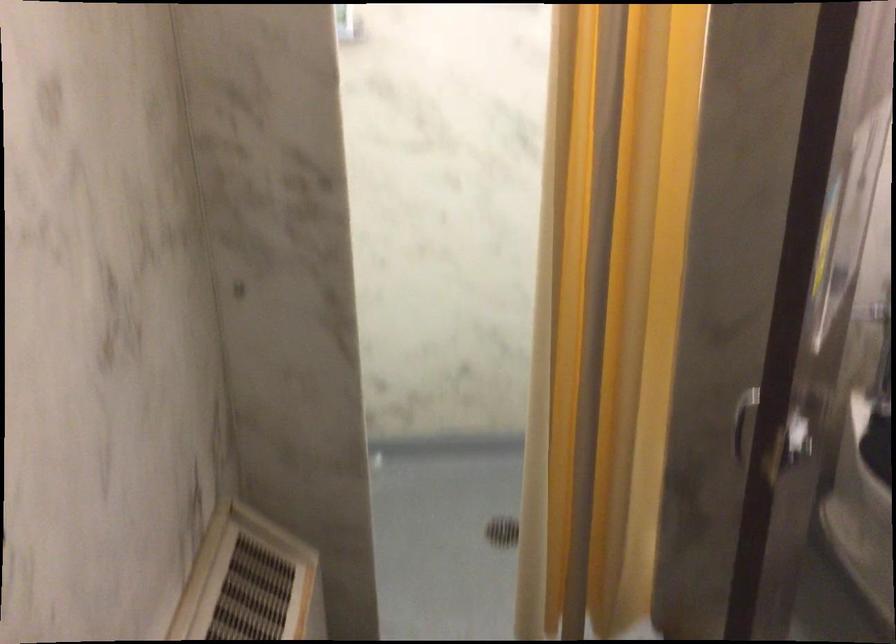
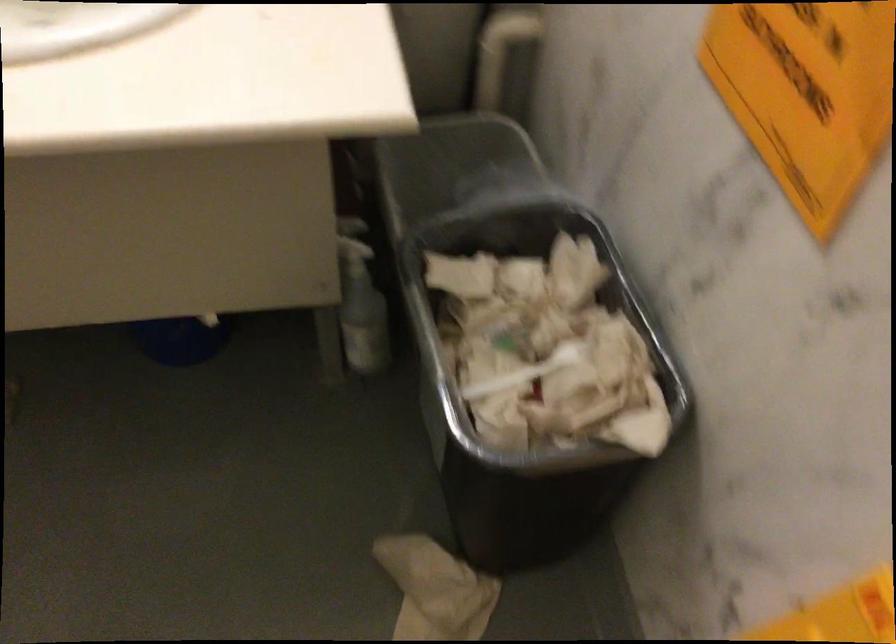
The images are taken continuously from a first-person perspective. In which direction is your viewpoint rotating?

The rotation direction of the camera is right-down.